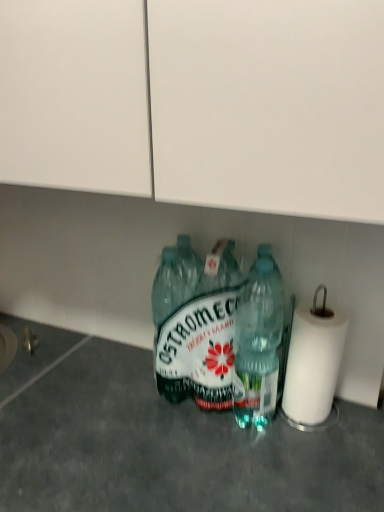
Where is `free spot in front of green plastic bottle at center, which ranks as the second bottle in right-to-left order`? This screenshot has width=384, height=512. free spot in front of green plastic bottle at center, which ranks as the second bottle in right-to-left order is located at coordinates (202, 455).